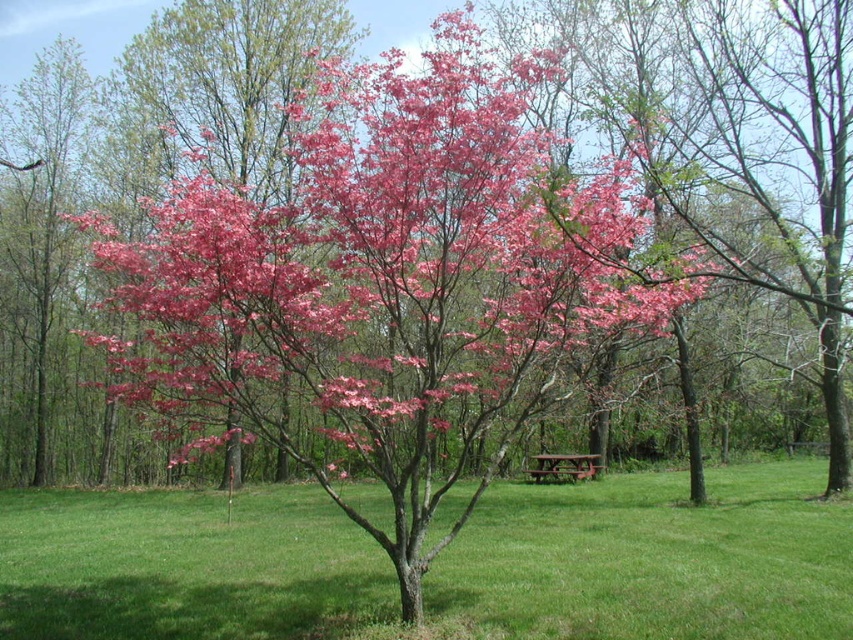
You are standing in the serene outdoor scene with the pink blossomed tree. There are two points marked on the ground. The first point is at coordinate point[607,488] and the second point is at coordinate point[59,144]. Which point is closer to you?

Point[607,488] is in front of point[59,144], so it is closer to you.

You are a landscape architect planning to install a walkway between the pink glossy tree at center and the pink matte tree at left. The walkway will be 4 meters long. Will the walkway fit between them?

The distance between the pink glossy tree at center and the pink matte tree at left is 4.42 meters, so a 4 meter walkway will fit between them.